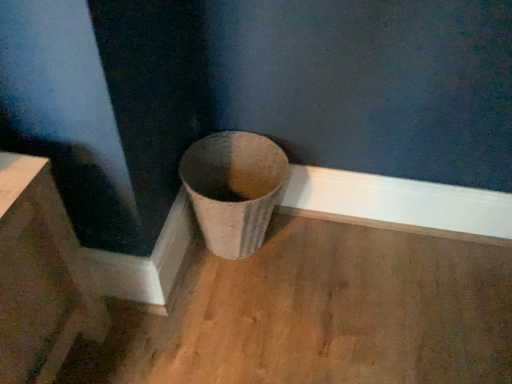
The height and width of the screenshot is (384, 512). What do you see at coordinates (234, 189) in the screenshot?
I see `textured beige waste bin at lower center` at bounding box center [234, 189].

Locate an element on the screen. This screenshot has width=512, height=384. textured beige waste bin at lower center is located at coordinates (234, 189).

The height and width of the screenshot is (384, 512). Find the location of `textured beige waste bin at lower center`. textured beige waste bin at lower center is located at coordinates (234, 189).